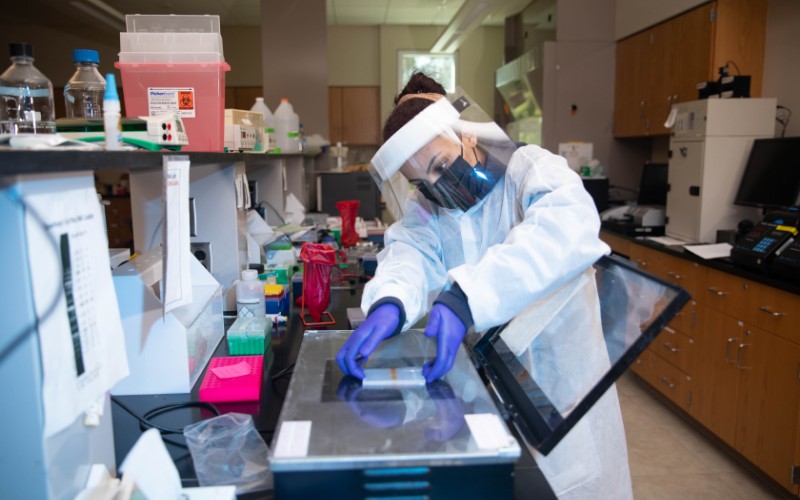
Image resolution: width=800 pixels, height=500 pixels. Identify the location of computer. (776, 181), (766, 246).